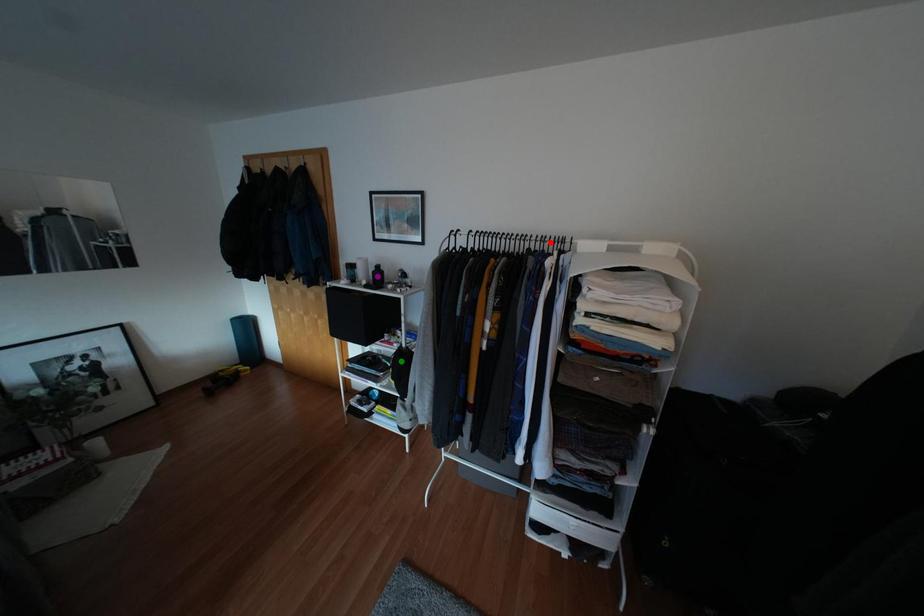
Order these from nearest to farthest:
green point
purple point
red point

green point → purple point → red point